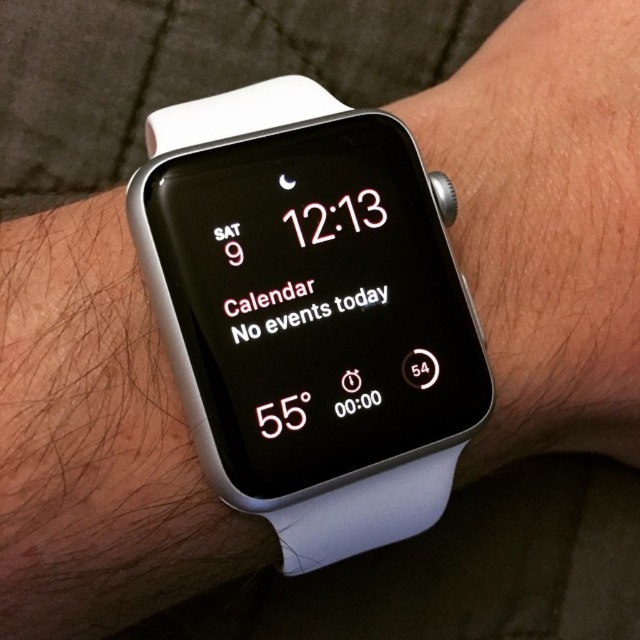
You are looking at a wristwatch and notice two layers on the watch face. The white plastic watch at center and the white rubber watch at center. Which one is positioned lower?

The white plastic watch at center is positioned lower than the white rubber watch at center according to the description.

You are looking at a smartwatch and want to check if the center of the watch is exactly at the point coordinates given. Is the point at coordinates (310, 312) located on the white plastic watch at center?

The point at coordinates (310, 312) corresponds to the white plastic watch at center, so yes, the point is located on the white plastic watch at center.